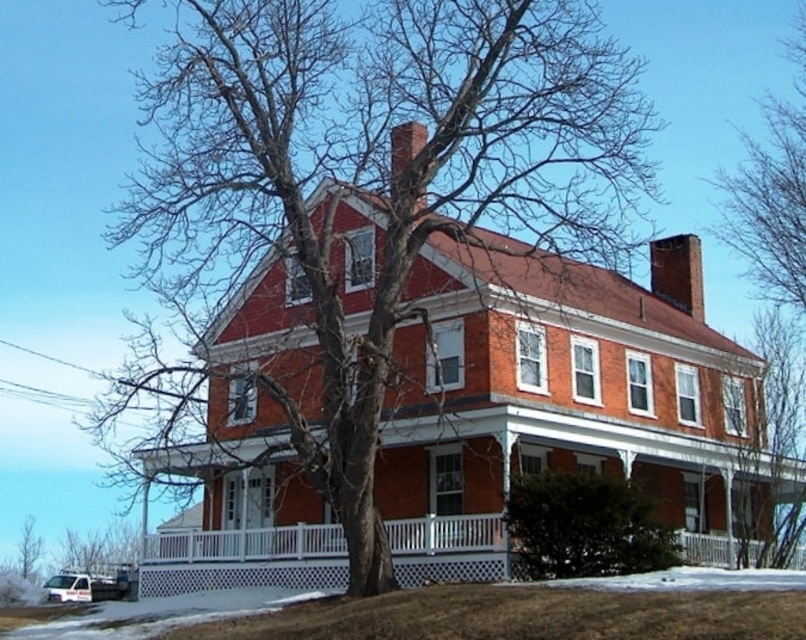
You are a bird looking for a place to perch. You see the bare wood tree at center and the smooth brick chimney at upper right. Which one is bigger in size?

The bare wood tree at center is bigger in size compared to the smooth brick chimney at upper right.

You are standing in front of the house and want to place a small garden ornament. You have two points marked on your map, point 1 at coordinates point (574, 246) and point 2 at coordinates point (791, 49). Which point is closer to you so you can place the ornament there?

Point (574, 246) is closer to the viewer than point (791, 49), so you should place the ornament at point (574, 246).

You are a painter planning to paint this house. You need to know which object, the bare wood tree at center or the smooth brick chimney at upper right, is wider to decide where to place your ladder. Can you tell me which one is wider?

The bare wood tree at center is wider than the smooth brick chimney at upper right.